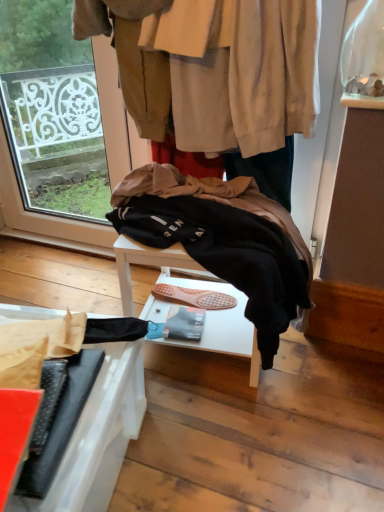
Question: Is black fleece jacket at center outside of black matte umbrella at lower left?

Choices:
 (A) no
 (B) yes

Answer: (B)

Question: Is black fleece jacket at center taller than black matte umbrella at lower left?

Choices:
 (A) no
 (B) yes

Answer: (B)

Question: Does black fleece jacket at center turn towards black matte umbrella at lower left?

Choices:
 (A) yes
 (B) no

Answer: (A)

Question: From the image's perspective, does black fleece jacket at center appear higher than black matte umbrella at lower left?

Choices:
 (A) yes
 (B) no

Answer: (A)

Question: Does black fleece jacket at center have a greater width compared to black matte umbrella at lower left?

Choices:
 (A) no
 (B) yes

Answer: (A)

Question: From a real-world perspective, relative to black matte umbrella at lower left, is black fleece jacket at center vertically above or below?

Choices:
 (A) above
 (B) below

Answer: (A)

Question: Relative to black matte umbrella at lower left, is black fleece jacket at center in front or behind?

Choices:
 (A) front
 (B) behind

Answer: (B)

Question: Is black fleece jacket at center bigger or smaller than black matte umbrella at lower left?

Choices:
 (A) small
 (B) big

Answer: (A)

Question: Considering the positions of black fleece jacket at center and black matte umbrella at lower left in the image, is black fleece jacket at center wider or thinner than black matte umbrella at lower left?

Choices:
 (A) wide
 (B) thin

Answer: (B)

Question: Is point (226, 184) positioned closer to the camera than point (274, 199)?

Choices:
 (A) closer
 (B) farther

Answer: (A)

Question: From a real-world perspective, is black fleece jacket at center above or below dark blue jeans at center?

Choices:
 (A) above
 (B) below

Answer: (B)

Question: Is black fleece jacket at center in front of or behind dark blue jeans at center in the image?

Choices:
 (A) behind
 (B) front

Answer: (B)

Question: Looking at the image, does black fleece jacket at center seem bigger or smaller compared to dark blue jeans at center?

Choices:
 (A) small
 (B) big

Answer: (B)

Question: From the image's perspective, relative to black matte umbrella at lower left, is dark blue jeans at center above or below?

Choices:
 (A) below
 (B) above

Answer: (B)

Question: Visually, is dark blue jeans at center positioned to the left or to the right of black matte umbrella at lower left?

Choices:
 (A) right
 (B) left

Answer: (A)